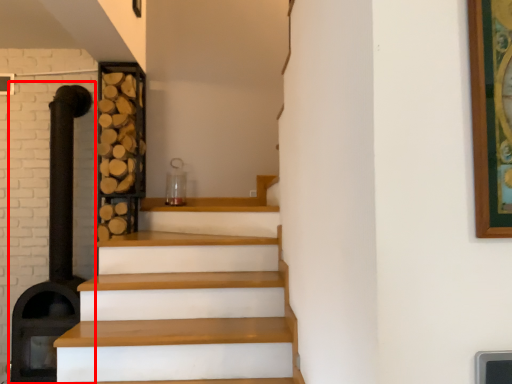
Question: From the image's perspective, what is the correct spatial positioning of fireplace (annotated by the red box) in reference to shelf?

Choices:
 (A) above
 (B) below

Answer: (B)